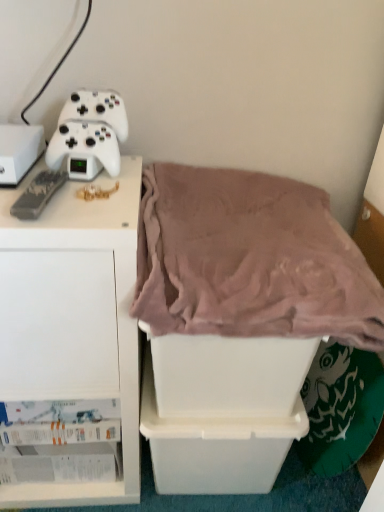
Question: Is white matte cabinet at left surrounded by mauve plush blanket at center?

Choices:
 (A) yes
 (B) no

Answer: (B)

Question: Is mauve plush blanket at center outside white matte cabinet at left?

Choices:
 (A) yes
 (B) no

Answer: (A)

Question: Is mauve plush blanket at center to the right of white matte cabinet at left from the viewer's perspective?

Choices:
 (A) yes
 (B) no

Answer: (A)

Question: Is mauve plush blanket at center to the left of white matte cabinet at left from the viewer's perspective?

Choices:
 (A) yes
 (B) no

Answer: (B)

Question: From the image's perspective, would you say mauve plush blanket at center is positioned over white matte cabinet at left?

Choices:
 (A) no
 (B) yes

Answer: (B)

Question: From a real-world perspective, is white plastic storage box at lower center, the first storage box positioned from the bottom, positioned above or below white matte cabinet at left?

Choices:
 (A) below
 (B) above

Answer: (A)

Question: Is white plastic storage box at lower center, the first storage box positioned from the bottom, taller or shorter than white matte cabinet at left?

Choices:
 (A) short
 (B) tall

Answer: (A)

Question: Looking at the image, does white plastic storage box at lower center, the 2th storage box when ordered from right to left, seem bigger or smaller compared to white matte cabinet at left?

Choices:
 (A) big
 (B) small

Answer: (B)

Question: From the image's perspective, is white plastic storage box at lower center, the 3th storage box when ordered from top to bottom, positioned above or below white matte cabinet at left?

Choices:
 (A) below
 (B) above

Answer: (A)

Question: From the image's perspective, is black matte game controller at left, which is the first game controller in front-to-back order, above or below white plastic storage box at center, which is counted as the first storage box, starting from the right?

Choices:
 (A) above
 (B) below

Answer: (A)

Question: Looking at the image, does black matte game controller at left, marked as the second game controller in a top-to-bottom arrangement, seem bigger or smaller compared to white plastic storage box at center, which is counted as the first storage box, starting from the right?

Choices:
 (A) big
 (B) small

Answer: (B)

Question: In the image, is black matte game controller at left, which is the second game controller in back-to-front order, on the left side or the right side of white plastic storage box at center, the second storage box from the top?

Choices:
 (A) left
 (B) right

Answer: (A)

Question: Considering the positions of black matte game controller at left, which is counted as the first game controller, starting from the bottom, and white plastic storage box at center, which is counted as the first storage box, starting from the right, in the image, is black matte game controller at left, which is counted as the first game controller, starting from the bottom, taller or shorter than white plastic storage box at center, which is counted as the first storage box, starting from the right,?

Choices:
 (A) short
 (B) tall

Answer: (A)

Question: Considering the positions of white plastic storage box at left, the third storage box when ordered from right to left, and white plastic storage box at center, marked as the 2th storage box in a bottom-to-top arrangement, in the image, is white plastic storage box at left, the third storage box when ordered from right to left, wider or thinner than white plastic storage box at center, marked as the 2th storage box in a bottom-to-top arrangement,?

Choices:
 (A) wide
 (B) thin

Answer: (B)

Question: From the image's perspective, is white plastic storage box at left, the third storage box when ordered from right to left, positioned above or below white plastic storage box at center, marked as the 2th storage box in a bottom-to-top arrangement?

Choices:
 (A) below
 (B) above

Answer: (B)